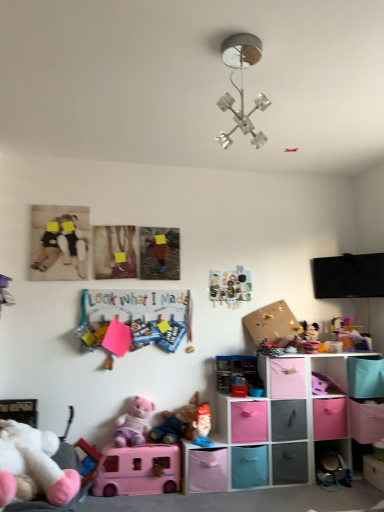
Question: Is point (29, 461) closer or farther from the camera than point (271, 459)?

Choices:
 (A) closer
 (B) farther

Answer: (A)

Question: In the image, is white plush toy at lower left, the second toy positioned from the left, on the left side or the right side of matte black storage cube at lower center, which appears as the 5th shelf when viewed from the left?

Choices:
 (A) left
 (B) right

Answer: (A)

Question: Which of these objects is positioned farthest from the transparent plastic shelf at lower right, which is the second shelf in right-to-left order?

Choices:
 (A) wooden climbing wall at center right, which is counted as the ninth toy, starting from the left
 (B) pink plush toy at lower center, marked as the 4th toy in a left-to-right arrangement
 (C) black matte teddy bear at left, the 1th toy from the left
 (D) pink fabric storage bin at lower center, arranged as the 5th shelf when viewed from the right
 (E) metallic silver magnets at center, the fourth toy from the right

Answer: (C)

Question: Estimate the real-world distances between objects in this image. Which object is farther from the metallic silver magnets at center, the fourth toy from the right?

Choices:
 (A) transparent plastic shelf at lower right, which is the second shelf in right-to-left order
 (B) matte plastic toy at center, the seventh toy in the left-to-right sequence
 (C) black matte teddy bear at left, the 1th toy from the left
 (D) translucent plastic toy at right, placed as the first toy when sorted from right to left
 (E) fabric storage cubes at lower right, which is the fourth shelf from right to left

Answer: (C)